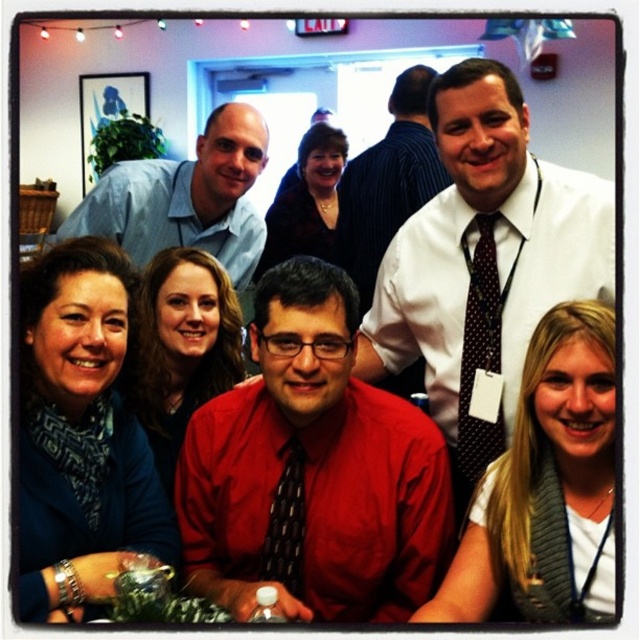
You are organizing a group photo and need to ensure there is enough space between the red satin shirt at center and the white dress shirt at upper right for a photographer to walk through. The photographer requires at least 3 feet of clearance. Based on the scene, can the photographer comfortably pass between them?

The red satin shirt at center and white dress shirt at upper right are 4.36 feet apart, which is more than the required 3 feet clearance. The photographer can comfortably pass between them.

You are attending a networking event and notice two men in the center of the group wearing ties. Which tie is located to the right of the other? The ties are labeled as the polka dot silk tie at center and the black dotted tie at center.

The polka dot silk tie at center is positioned to the right of the black dotted tie at center.

From the picture: You are an event planner arranging seating for a dinner. You see the white dress shirt at upper right and the black dotted tie at center in the image. Which of these two items should you place higher on the seating chart to match their positions in the image?

The white dress shirt at upper right should be placed higher on the seating chart since it is taller than the black dotted tie at center in the image.